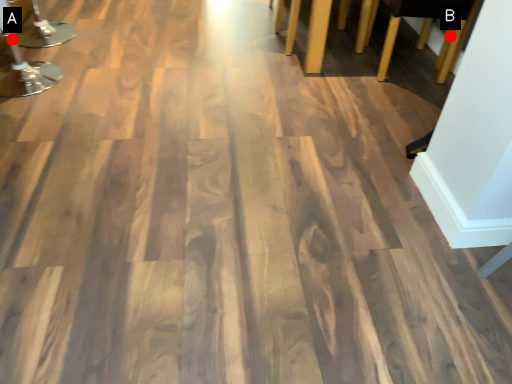
Question: Two points are circled on the image, labeled by A and B beside each circle. Which point is closer to the camera?

Choices:
 (A) A is closer
 (B) B is closer

Answer: (B)